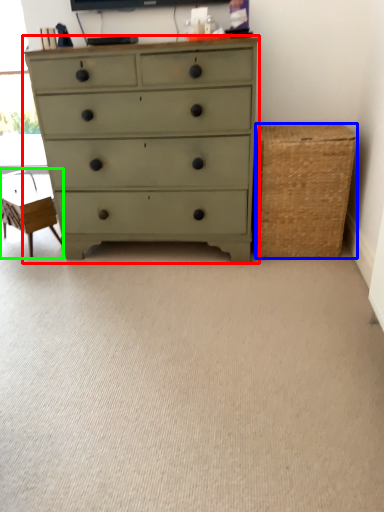
Question: Considering the real-world distances, which object is closest to chest of drawers (highlighted by a red box)? basket (highlighted by a blue box) or swivel chair (highlighted by a green box).

Choices:
 (A) basket
 (B) swivel chair

Answer: (A)